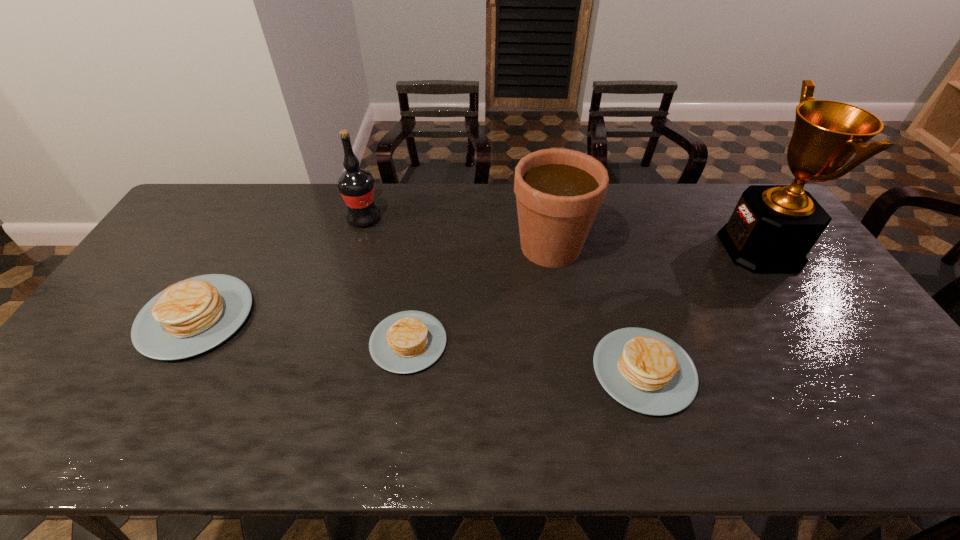
The image size is (960, 540). Find the location of `wine bottle that is at the far edge`. wine bottle that is at the far edge is located at coordinates click(356, 186).

This screenshot has height=540, width=960. What are the coordinates of `object positioned at the left edge` in the screenshot? It's located at (192, 316).

You are a GUI agent. You are given a task and a screenshot of the screen. Output one action in this format:
    pyautogui.click(x=<x>, y=<y>)
    Task: Click on the object located at the right edge
    
    Given the screenshot: What is the action you would take?
    pyautogui.click(x=772, y=229)

Find the location of a particular element. The width and height of the screenshot is (960, 540). object present at the far right corner is located at coordinates 772,229.

Identify the location of vacant region at the far edge of the desktop. (377, 202).

Where is `free location at the near edge of the desktop`? free location at the near edge of the desktop is located at coordinates [269, 375].

In the image, there is a desktop. Identify the location of free region at the left edge. (81, 357).

Where is `vacant space at the right edge of the desktop`? Image resolution: width=960 pixels, height=540 pixels. vacant space at the right edge of the desktop is located at coordinates (x=826, y=335).

Locate an element on the screen. The width and height of the screenshot is (960, 540). vacant area at the far left corner is located at coordinates [x=205, y=205].

Where is `blank space at the near left corner of the desktop`? blank space at the near left corner of the desktop is located at coordinates (70, 386).